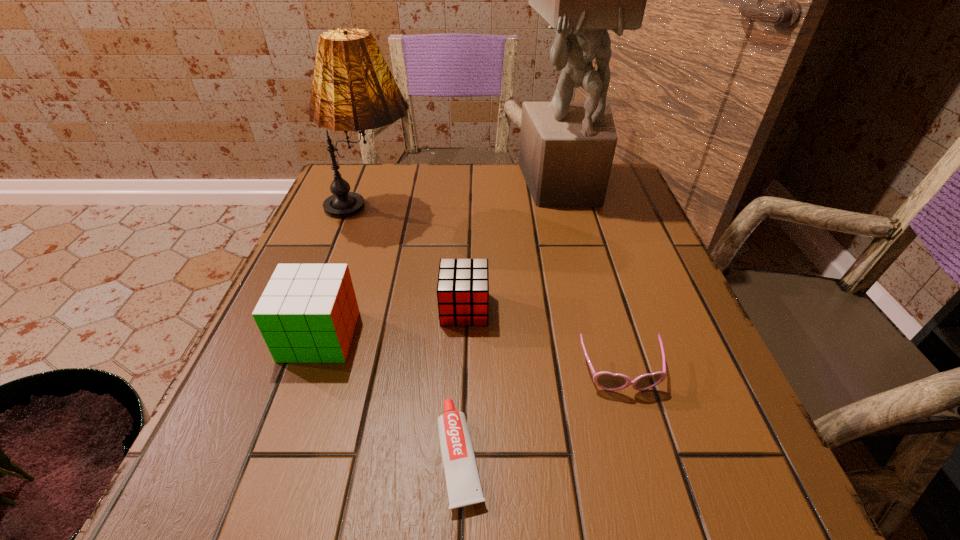
Point out which object is positioned as the nearest to the fourth shortest object. Please provide its 2D coordinates. Your answer should be formatted as a tuple, i.e. [(x, y)], where the tuple contains the x and y coordinates of a point satisfying the conditions above.

[(463, 284)]

Image resolution: width=960 pixels, height=540 pixels. Identify the location of object that is the fifth closest to the sculpture. (463, 483).

You are a GUI agent. You are given a task and a screenshot of the screen. Output one action in this format:
    pyautogui.click(x=<x>, y=<y>)
    Task: Click on the free location that satisfies the following two spatial constraints: 1. on the front-facing side of the lampshade; 2. on the back side of the toothpaste
    Image resolution: width=960 pixels, height=540 pixels.
    Given the screenshot: What is the action you would take?
    pyautogui.click(x=291, y=455)

At what (x,y) coordinates should I click in order to perform the action: click on vacant region that satisfies the following two spatial constraints: 1. on the back side of the right cube; 2. on the front-facing side of the lampshade. Please return your answer as a coordinate pair (x, y). The width and height of the screenshot is (960, 540). Looking at the image, I should click on (468, 213).

This screenshot has height=540, width=960. Find the location of `vacant space that satisfies the following two spatial constraints: 1. on the front-facing side of the shortest object; 2. on the left side of the lampshade`. vacant space that satisfies the following two spatial constraints: 1. on the front-facing side of the shortest object; 2. on the left side of the lampshade is located at coordinates (291, 455).